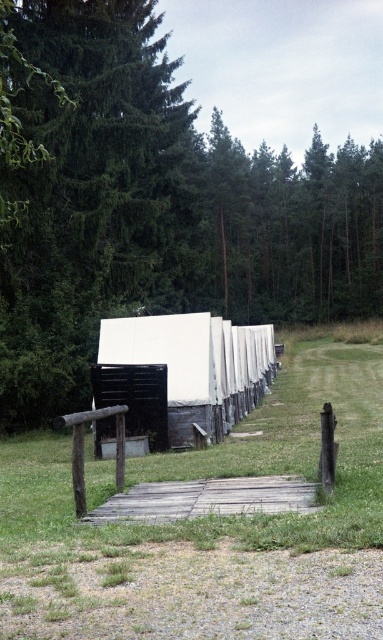
How distant is green leafy tree at upper left from wooden plank at center?

green leafy tree at upper left is 21.48 meters from wooden plank at center.

Between green leafy tree at upper left and wooden plank at center, which one appears on the right side from the viewer's perspective?

green leafy tree at upper left is more to the right.

Describe the element at coordinates (158, 209) in the screenshot. I see `green leafy tree at upper left` at that location.

This screenshot has height=640, width=383. I want to click on green leafy tree at upper left, so click(x=158, y=209).

Is white matte tent at center above wooden plank at center?

Yes.

Is white matte tent at center shorter than wooden plank at center?

No, white matte tent at center is not shorter than wooden plank at center.

Image resolution: width=383 pixels, height=640 pixels. Identify the location of white matte tent at center. (181, 374).

Where is `white matte tent at center`? The image size is (383, 640). white matte tent at center is located at coordinates (181, 374).

Is green leafy tree at upper left closer to camera compared to green grass at center?

No, it is not.

What do you see at coordinates (158, 209) in the screenshot? This screenshot has height=640, width=383. I see `green leafy tree at upper left` at bounding box center [158, 209].

This screenshot has width=383, height=640. Find the location of `green leafy tree at upper left`. green leafy tree at upper left is located at coordinates (158, 209).